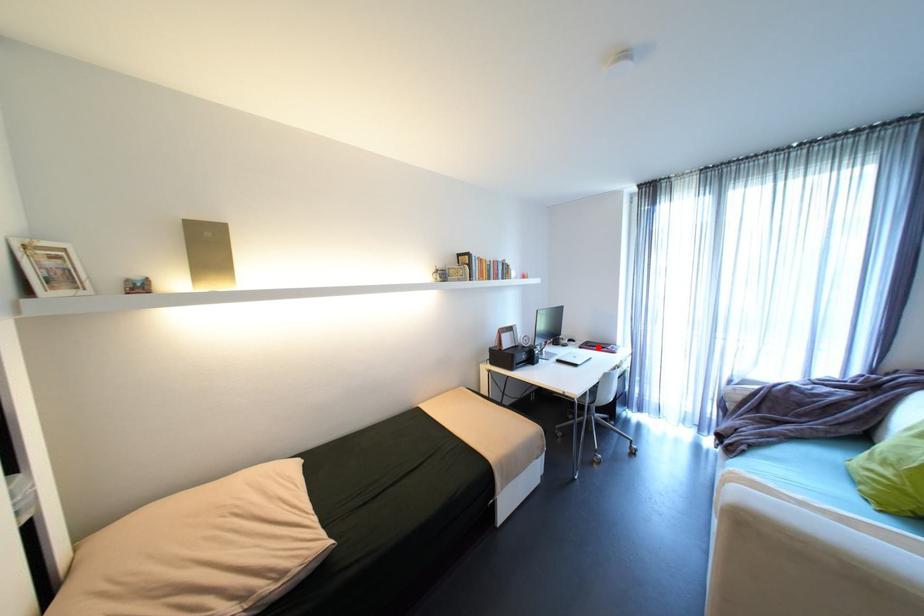
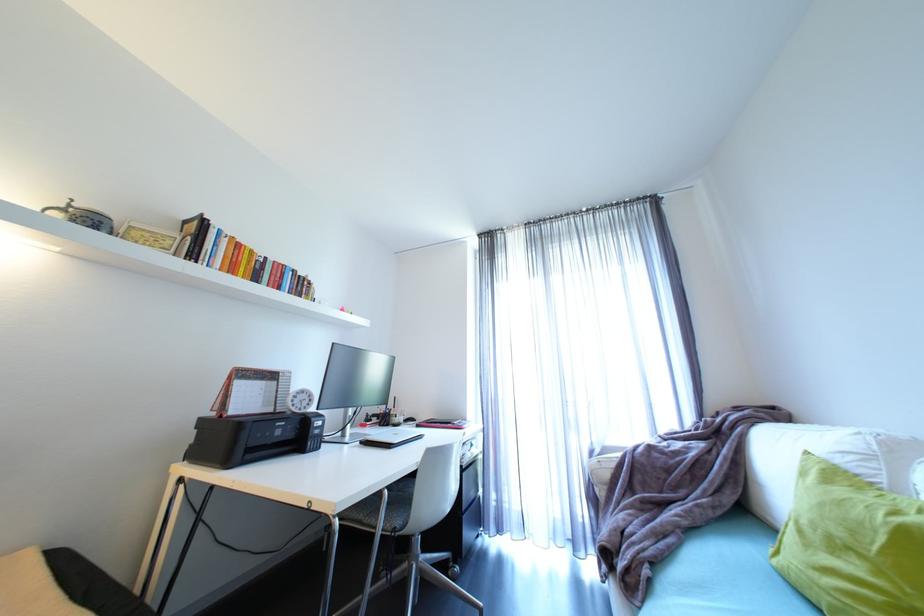
Locate, in the second image, the point that corresponds to the highlighted location in the first image.

(440, 424)